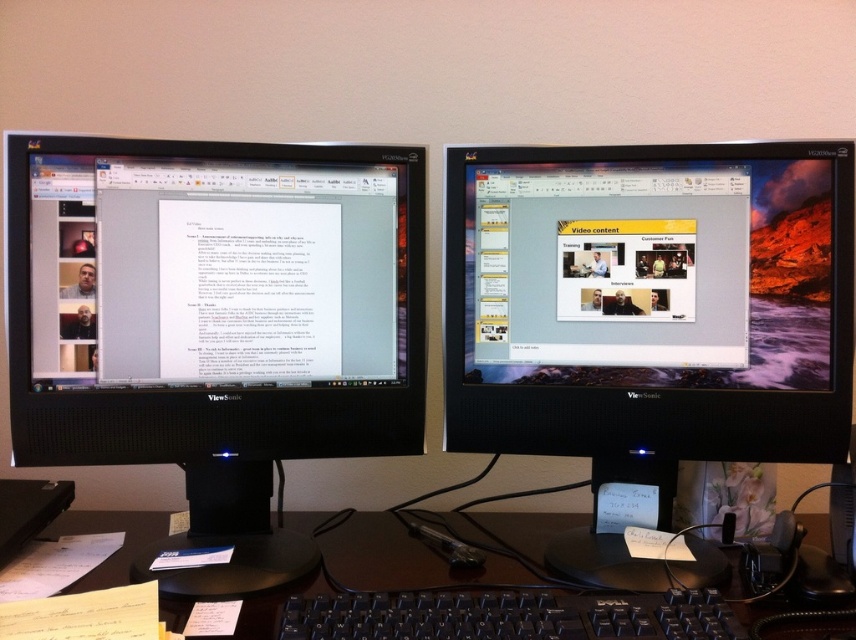
Measure the distance between black glossy monitor at left and camera.

A distance of 32.83 inches exists between black glossy monitor at left and camera.

Does point (22, 144) come farther from viewer compared to point (434, 637)?

Yes, it is.

Image resolution: width=856 pixels, height=640 pixels. Describe the element at coordinates (214, 323) in the screenshot. I see `black glossy monitor at left` at that location.

This screenshot has height=640, width=856. Identify the location of black glossy monitor at left. (214, 323).

Is black glossy monitor at center to the right of black plastic keyboard at lower center from the viewer's perspective?

Correct, you'll find black glossy monitor at center to the right of black plastic keyboard at lower center.

Describe the element at coordinates (646, 317) in the screenshot. I see `black glossy monitor at center` at that location.

Which is in front, point (718, 428) or point (355, 608)?

Point (355, 608) is in front.

Locate an element on the screen. Image resolution: width=856 pixels, height=640 pixels. black glossy monitor at center is located at coordinates (646, 317).

Does black glossy monitor at left come in front of black plastic keyboard at lower center?

No, black glossy monitor at left is behind black plastic keyboard at lower center.

Does black glossy monitor at left have a greater width compared to black plastic keyboard at lower center?

Incorrect, black glossy monitor at left's width does not surpass black plastic keyboard at lower center's.

Who is more distant from viewer, [348,308] or [98,515]?

The point [98,515] is more distant.

You are a GUI agent. You are given a task and a screenshot of the screen. Output one action in this format:
    pyautogui.click(x=<x>, y=<y>)
    Task: Click on the black glossy monitor at left
    The image size is (856, 640).
    Given the screenshot: What is the action you would take?
    pyautogui.click(x=214, y=323)